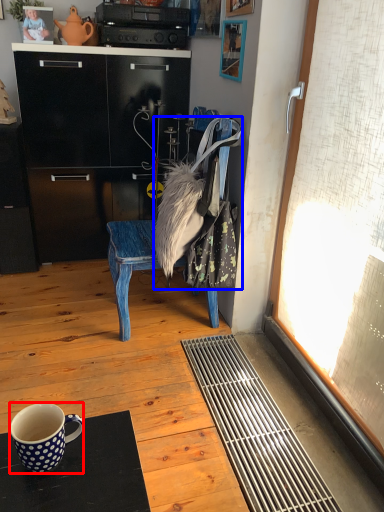
Question: Which of the following is the farthest to the observer, coffee cup (highlighted by a red box) or handbag (highlighted by a blue box)?

Choices:
 (A) coffee cup
 (B) handbag

Answer: (B)